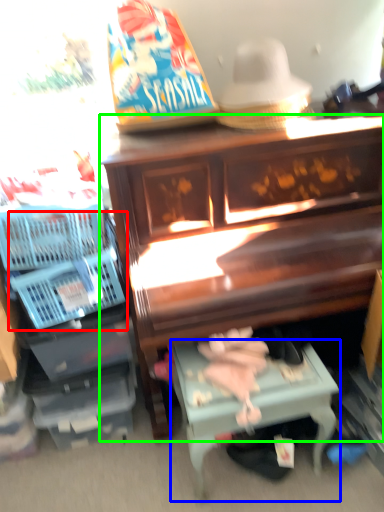
Question: Which is nearer to the basket (highlighted by a red box)? table (highlighted by a blue box) or furniture (highlighted by a green box).

Choices:
 (A) table
 (B) furniture

Answer: (B)